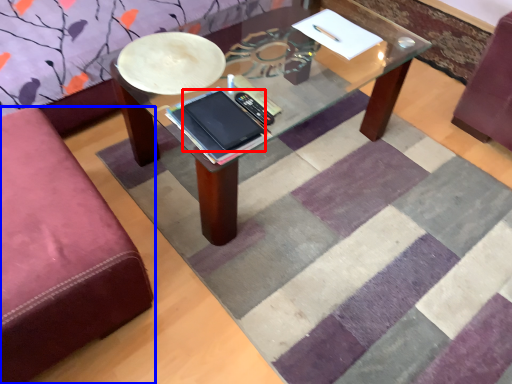
Question: Which object is further to the camera taking this photo, tablet computer (highlighted by a red box) or studio couch (highlighted by a blue box)?

Choices:
 (A) tablet computer
 (B) studio couch

Answer: (A)